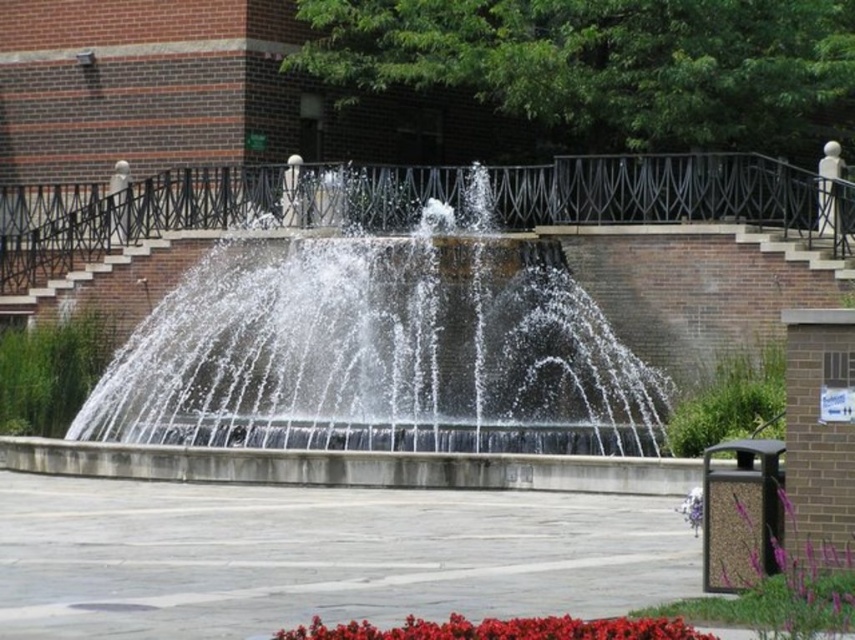
Question: Which object is positioned farthest from the purple matte flower at lower right?

Choices:
 (A) clear concrete fountain at center
 (B) smooth glossy flowers at lower center

Answer: (A)

Question: Which point is farther to the camera?

Choices:
 (A) clear concrete fountain at center
 (B) smooth glossy flowers at lower center
 (C) purple matte flower at lower right

Answer: (A)

Question: Is clear concrete fountain at center above smooth glossy flowers at lower center?

Choices:
 (A) no
 (B) yes

Answer: (B)

Question: Which object appears closest to the camera in this image?

Choices:
 (A) smooth glossy flowers at lower center
 (B) clear concrete fountain at center
 (C) purple matte flower at lower right

Answer: (A)

Question: Observing the image, what is the correct spatial positioning of smooth glossy flowers at lower center in reference to purple matte flower at lower right?

Choices:
 (A) right
 (B) left

Answer: (B)

Question: Can you confirm if smooth glossy flowers at lower center is positioned above purple matte flower at lower right?

Choices:
 (A) yes
 (B) no

Answer: (A)